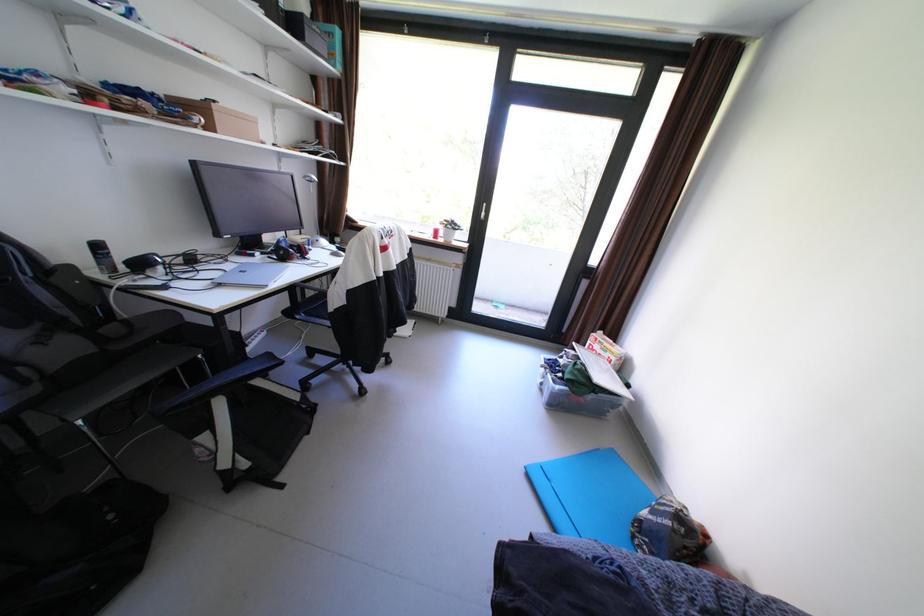
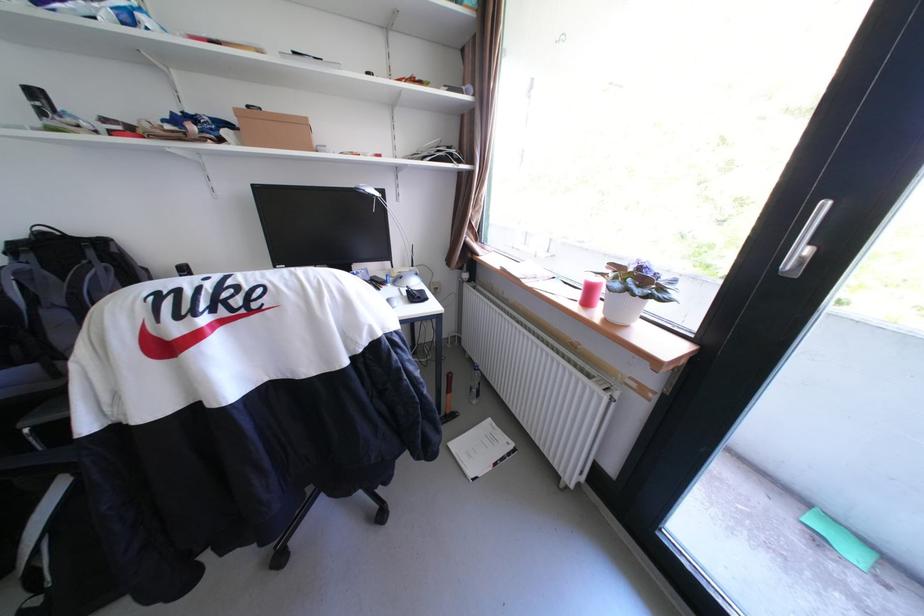
The point at (446, 233) is marked in the first image. Where is the corresponding point in the second image?

(601, 291)